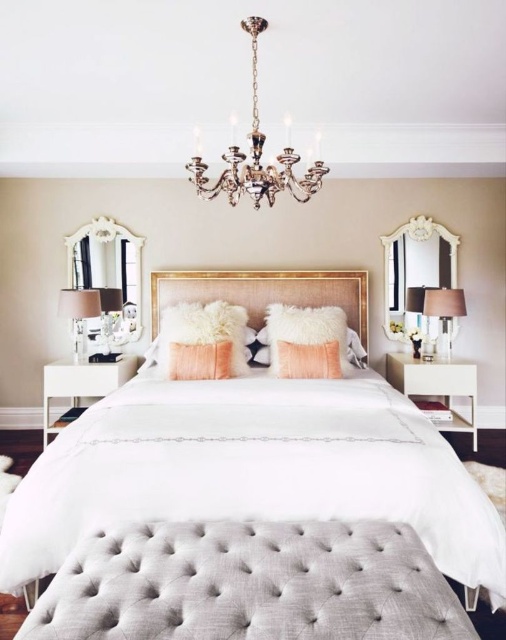
Question: Considering the relative positions of brown fabric lampshade at right and matte black lampshade at left in the image provided, where is brown fabric lampshade at right located with respect to matte black lampshade at left?

Choices:
 (A) left
 (B) right

Answer: (B)

Question: Can you confirm if matte peach pillow at center is positioned below matte white lampshade at left?

Choices:
 (A) yes
 (B) no

Answer: (A)

Question: Is matte peach pillow at center above matte black lampshade at left?

Choices:
 (A) yes
 (B) no

Answer: (B)

Question: Among these points, which one is nearest to the camera?

Choices:
 (A) (268, 317)
 (B) (428, 292)

Answer: (B)

Question: Which point is closer to the camera?

Choices:
 (A) (291, 184)
 (B) (415, 340)
 (C) (294, 364)

Answer: (C)

Question: Which of these objects is positioned farthest from the white fluffy pillow at center?

Choices:
 (A) polished brass chandelier at upper center
 (B) matte peach pillow at center
 (C) matte black lampshade at left

Answer: (C)